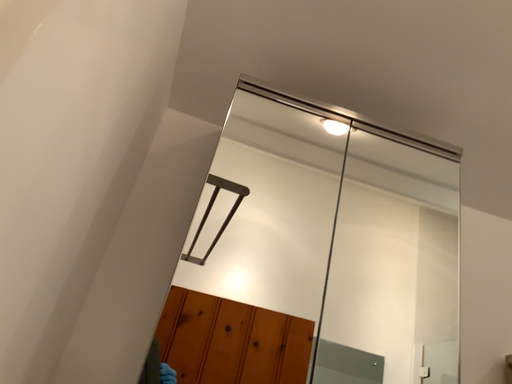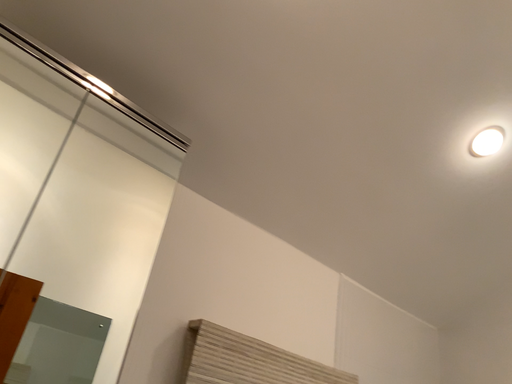
Question: Which way did the camera rotate in the video?

Choices:
 (A) rotated downward
 (B) rotated upward

Answer: (A)